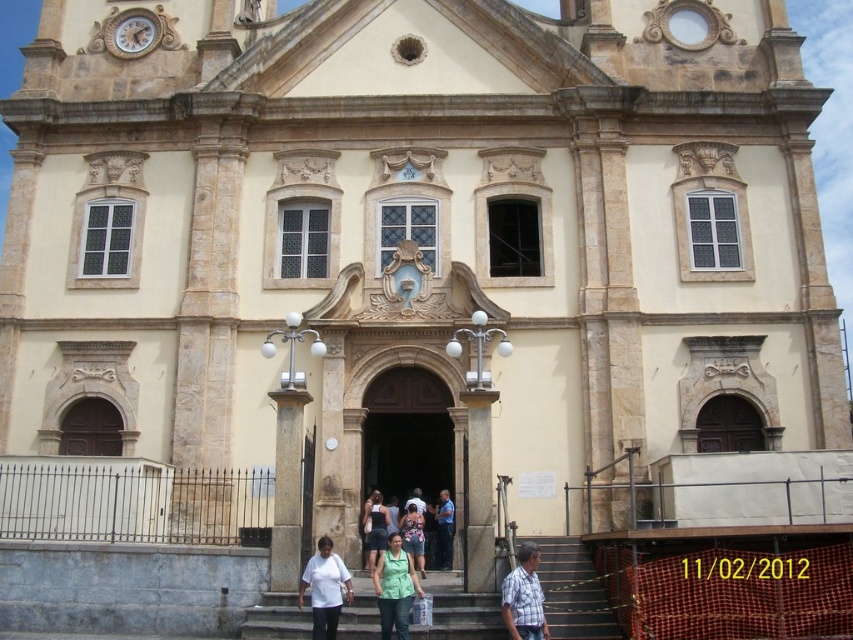
Question: Based on their relative distances, which object is farther from the white matte shirt at center?

Choices:
 (A) dark blue denim shorts at center
 (B) stone stairs at center

Answer: (A)

Question: Observing the image, what is the correct spatial positioning of white matte shirt at center in reference to green matte shirt at center?

Choices:
 (A) right
 (B) left

Answer: (B)

Question: Which point is closer to the camera?

Choices:
 (A) (386, 556)
 (B) (404, 544)
 (C) (502, 608)

Answer: (C)

Question: Which of the following is the farthest from the observer?

Choices:
 (A) white matte shirt at center
 (B) stone stairs at center
 (C) dark blue denim shorts at center
 (D) denim shorts at center

Answer: (D)

Question: Does plaid cotton shirt at lower right have a larger size compared to dark blue denim shorts at center?

Choices:
 (A) yes
 (B) no

Answer: (B)

Question: Does green matte shirt at center come in front of denim shorts at center?

Choices:
 (A) no
 (B) yes

Answer: (B)